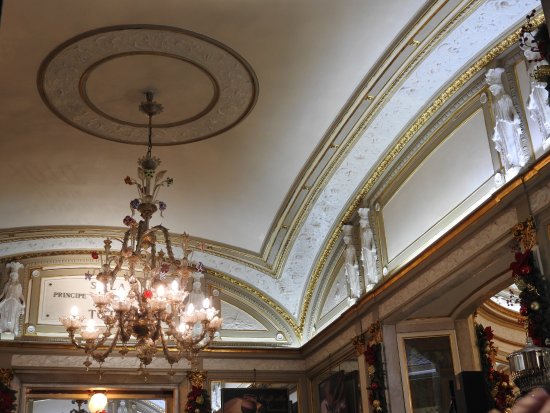
Where is `gold gilding`? gold gilding is located at coordinates (296, 331).